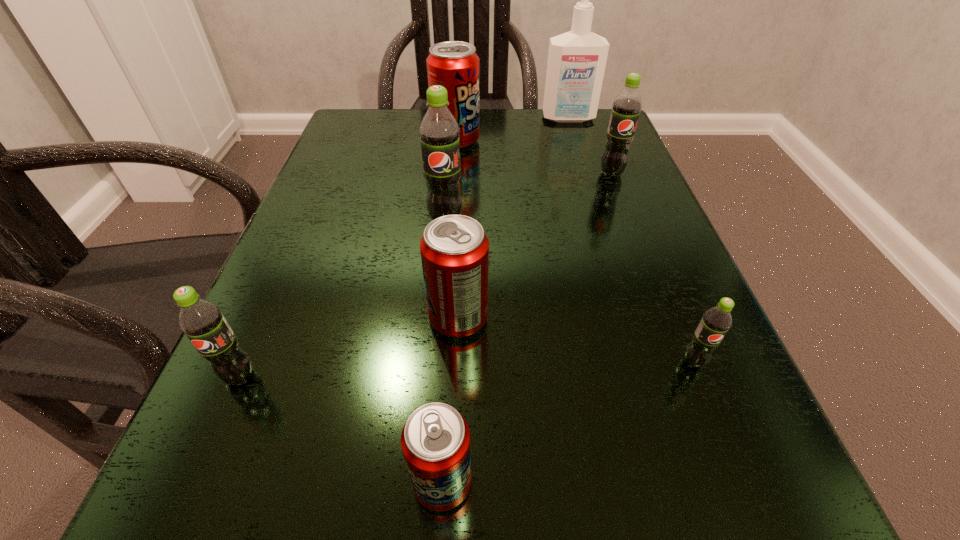
This screenshot has width=960, height=540. I want to click on cleansing agent, so click(576, 64).

The width and height of the screenshot is (960, 540). I want to click on the farthest object, so click(x=576, y=64).

This screenshot has height=540, width=960. Identify the location of the seventh shortest object. (439, 132).

This screenshot has height=540, width=960. I want to click on the third green soda from right to left, so click(439, 132).

Identify the location of the third farthest object. The height and width of the screenshot is (540, 960). (626, 107).

The image size is (960, 540). Identify the location of the second farthest soda can. (626, 107).

The width and height of the screenshot is (960, 540). Identify the location of the seventh nearest object. (454, 65).

Where is `the biggest red soda can`? Image resolution: width=960 pixels, height=540 pixels. the biggest red soda can is located at coordinates (454, 65).

Locate an element on the screen. Image resolution: width=960 pixels, height=540 pixels. the leftmost object is located at coordinates (202, 321).

Identify the location of the leftmost green soda. (202, 321).